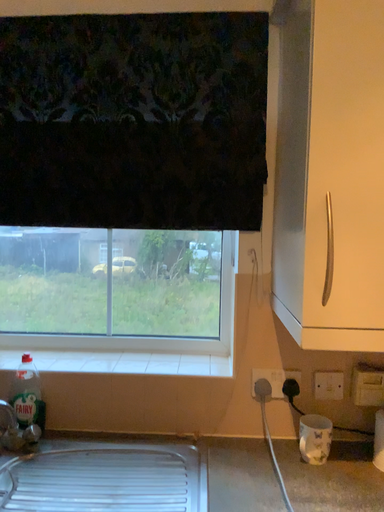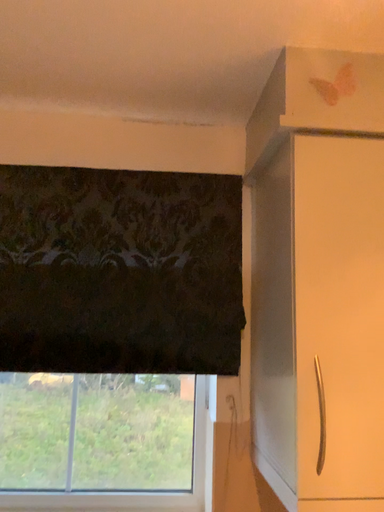
Question: How did the camera likely rotate when shooting the video?

Choices:
 (A) rotated right
 (B) rotated left

Answer: (A)